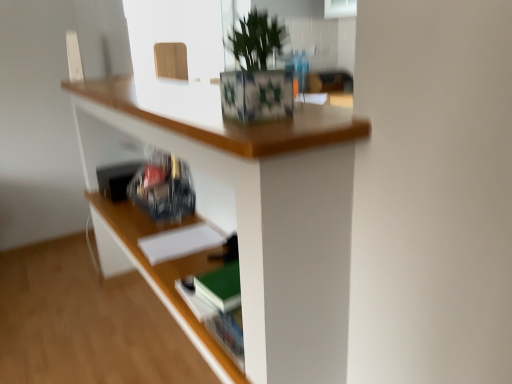
Where is `wooden desk at upper center`? This screenshot has width=512, height=384. wooden desk at upper center is located at coordinates (256, 209).

What do you see at coordinates (179, 242) in the screenshot? This screenshot has width=512, height=384. I see `white matte paper at center` at bounding box center [179, 242].

In order to face white matte paper at center, should I rotate leftwards or rightwards?

Turn left approximately 10.849 degrees to face it.

Measure the distance between point (267, 98) and camera.

Point (267, 98) and camera are 81.40 centimeters apart from each other.

Identify the location of wooden desk at upper center. The image size is (512, 384). click(256, 209).

From the image's perspective, is wooden desk at upper center below wooden frame at upper center?

Yes, from the image's perspective, wooden desk at upper center is beneath wooden frame at upper center.

Is wooden desk at upper center bigger or smaller than wooden frame at upper center?

In the image, wooden desk at upper center appears to be larger than wooden frame at upper center.

Is wooden frame at upper center surrounded by wooden desk at upper center?

No, wooden frame at upper center is not a part of wooden desk at upper center.

From a real-world perspective, which object stands above the other?

wooden frame at upper center.

What's the angular difference between green leafy plant at upper center and white matte paper at center's facing directions?

The facing directions of green leafy plant at upper center and white matte paper at center are 1 degrees apart.

Who is bigger, green leafy plant at upper center or white matte paper at center?

Bigger between the two is green leafy plant at upper center.

Is point (282, 30) farther from camera compared to point (194, 244)?

No, it is not.

From a real-world perspective, is wooden frame at upper center positioned above or below white matte paper at center?

In terms of real-world spatial position, wooden frame at upper center is above white matte paper at center.

Is point (142, 76) farther from camera compared to point (185, 250)?

Yes, it is.

Is wooden frame at upper center not near white matte paper at center?

Absolutely, wooden frame at upper center is distant from white matte paper at center.

Considering the relative sizes of wooden frame at upper center and white matte paper at center in the image provided, is wooden frame at upper center bigger than white matte paper at center?

Correct, wooden frame at upper center is larger in size than white matte paper at center.

From a real-world perspective, is white matte paper at center below wooden frame at upper center?

Yes, from a real-world perspective, white matte paper at center is below wooden frame at upper center.

Is white matte paper at center completely or partially outside of wooden frame at upper center?

Indeed, white matte paper at center is completely outside wooden frame at upper center.

From the image's perspective, which is below, white matte paper at center or wooden frame at upper center?

From the image's view, white matte paper at center is below.

Is white matte paper at center positioned with its back to wooden frame at upper center?

white matte paper at center is not turned away from wooden frame at upper center.

Looking at their sizes, would you say wooden frame at upper center is wider or thinner than wooden desk at upper center?

wooden frame at upper center is thinner than wooden desk at upper center.

Looking at this image, considering the sizes of objects wooden frame at upper center and wooden desk at upper center in the image provided, who is shorter, wooden frame at upper center or wooden desk at upper center?

wooden frame at upper center.

Is the position of wooden frame at upper center less distant than that of wooden desk at upper center?

No, it is behind wooden desk at upper center.

Is white matte paper at center smaller than wooden desk at upper center?

Correct, white matte paper at center occupies less space than wooden desk at upper center.

Considering the sizes of objects white matte paper at center and wooden desk at upper center in the image provided, who is shorter, white matte paper at center or wooden desk at upper center?

white matte paper at center is shorter.

Which is in front, white matte paper at center or wooden desk at upper center?

wooden desk at upper center is more forward.

From the image's perspective, is white matte paper at center positioned above or below wooden desk at upper center?

white matte paper at center is situated lower than wooden desk at upper center in the image.

Considering the relative positions of wooden frame at upper center and green leafy plant at upper center in the image provided, is wooden frame at upper center to the right of green leafy plant at upper center from the viewer's perspective?

No.

Between point (124, 6) and point (229, 87), which one is positioned in front?

The point (229, 87) is closer to the camera.

Image resolution: width=512 pixels, height=384 pixels. In order to click on window screen on the left side of green leafy plant at upper center in this screenshot , I will do `click(183, 33)`.

Which is in front, wooden frame at upper center or green leafy plant at upper center?

green leafy plant at upper center is more forward.

Identify the location of desk to the right of wooden frame at upper center. (256, 209).

The image size is (512, 384). Find the location of `houseplant located above the white matte paper at center (from the image's perspective)`. houseplant located above the white matte paper at center (from the image's perspective) is located at coordinates (x=256, y=72).

Looking at the image, which one is located further to green leafy plant at upper center, wooden frame at upper center or wooden desk at upper center?

wooden frame at upper center lies further to green leafy plant at upper center than the other object.

Which object lies nearer to the anchor point green leafy plant at upper center, wooden desk at upper center or wooden frame at upper center?

wooden desk at upper center is closer to green leafy plant at upper center.

Considering their positions, is white matte paper at center positioned further to wooden desk at upper center than green leafy plant at upper center?

white matte paper at center is positioned further to the anchor wooden desk at upper center.

Looking at the image, which one is located further to wooden frame at upper center, white matte paper at center or wooden desk at upper center?

white matte paper at center is further to wooden frame at upper center.

When comparing their distances from wooden frame at upper center, does green leafy plant at upper center or wooden desk at upper center seem closer?

The object closer to wooden frame at upper center is wooden desk at upper center.

When comparing their distances from white matte paper at center, does wooden desk at upper center or wooden frame at upper center seem further?

Among the two, wooden frame at upper center is located further to white matte paper at center.

From the image, which object appears to be nearer to green leafy plant at upper center, wooden desk at upper center or white matte paper at center?

Based on the image, wooden desk at upper center appears to be nearer to green leafy plant at upper center.

Looking at the image, which one is located closer to white matte paper at center, green leafy plant at upper center or wooden desk at upper center?

wooden desk at upper center.

Find the location of a particular element. This screenshot has height=384, width=512. houseplant between wooden desk at upper center and white matte paper at center along the z-axis is located at coordinates (256, 72).

Where is `houseplant between wooden desk at upper center and wooden frame at upper center from front to back`? The image size is (512, 384). houseplant between wooden desk at upper center and wooden frame at upper center from front to back is located at coordinates (256, 72).

The image size is (512, 384). In order to click on paperback book between wooden desk at upper center and wooden frame at upper center in the front-back direction in this screenshot , I will do `click(179, 242)`.

Find the location of a particular element. paperback book located between green leafy plant at upper center and wooden frame at upper center in the depth direction is located at coordinates (179, 242).